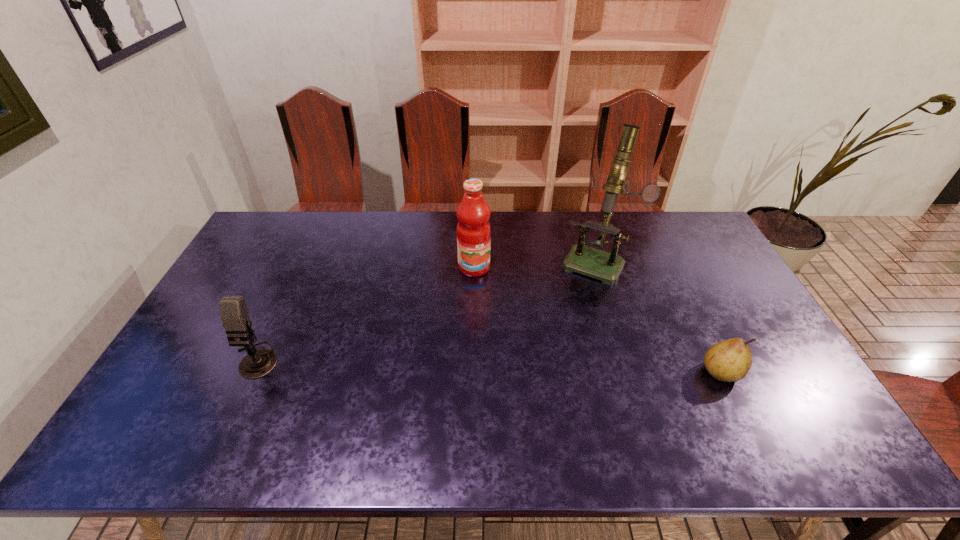
You are a GUI agent. You are given a task and a screenshot of the screen. Output one action in this format:
    pyautogui.click(x=<x>, y=<y>)
    Task: Click on the vacant space that's between the leftmost object and the third object from right to left
    Image resolution: width=960 pixels, height=540 pixels.
    Given the screenshot: What is the action you would take?
    pyautogui.click(x=365, y=313)

Identify the location of vacant space in between the rightmost object and the microphone. (489, 366).

Where is `free spot between the leftmost object and the tallest object`? free spot between the leftmost object and the tallest object is located at coordinates (426, 310).

Locate an element on the screen. free space between the second tallest object and the microscope is located at coordinates (536, 264).

You are a GUI agent. You are given a task and a screenshot of the screen. Output one action in this format:
    pyautogui.click(x=<x>, y=<y>)
    Task: Click on the vacant region between the microscope and the microphone
    This screenshot has height=540, width=960.
    Given the screenshot: What is the action you would take?
    pyautogui.click(x=426, y=310)

Where is `unoccupied area between the third shortest object and the microphone`? The image size is (960, 540). unoccupied area between the third shortest object and the microphone is located at coordinates (365, 313).

This screenshot has height=540, width=960. Identify the location of object that is the closest to the pear. (592, 262).

Locate which object is the third closest to the second shortest object. Please provide its 2D coordinates. Your answer should be formatted as a tuple, i.e. [(x, y)], where the tuple contains the x and y coordinates of a point satisfying the conditions above.

[(730, 360)]

You are a GUI agent. You are given a task and a screenshot of the screen. Output one action in this format:
    pyautogui.click(x=<x>, y=<y>)
    Task: Click on the free space that satisfies the following two spatial constraints: 1. on the front-facing side of the shortest object; 2. on the right side of the third tallest object
    
    Given the screenshot: What is the action you would take?
    pyautogui.click(x=250, y=372)

In order to click on vacant space that satisfies the following two spatial constraints: 1. on the front-facing side of the microphone; 2. on the left side of the rightmost object in this screenshot , I will do `click(250, 372)`.